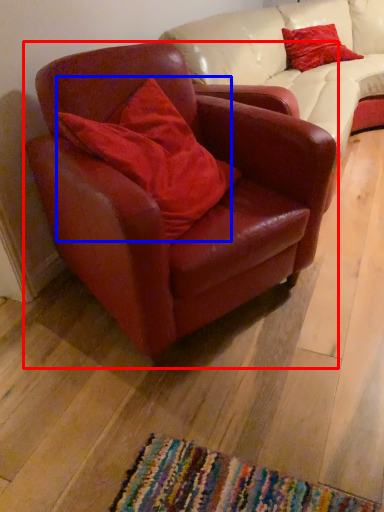
Question: Among these objects, which one is nearest to the camera, chair (highlighted by a red box) or pillow (highlighted by a blue box)?

Choices:
 (A) chair
 (B) pillow

Answer: (A)